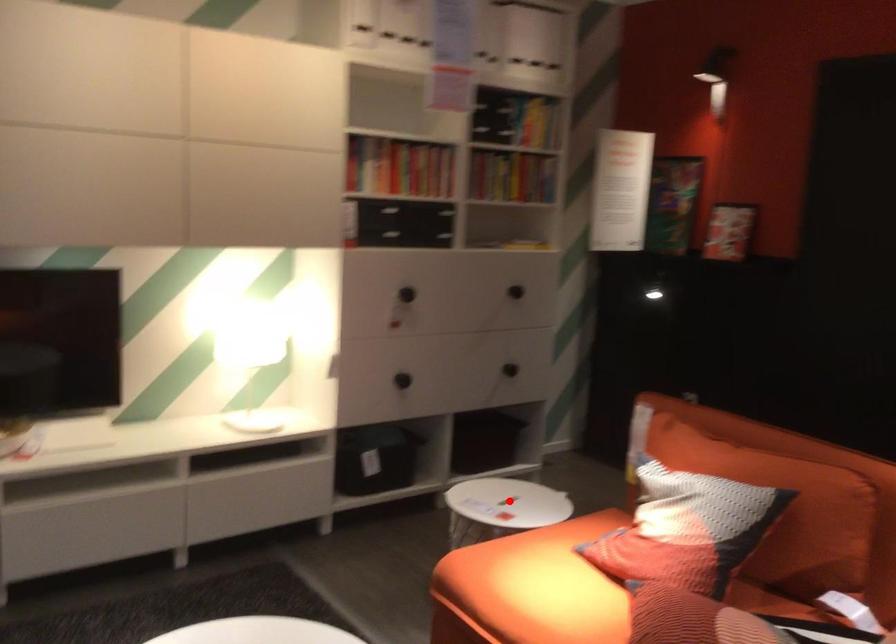
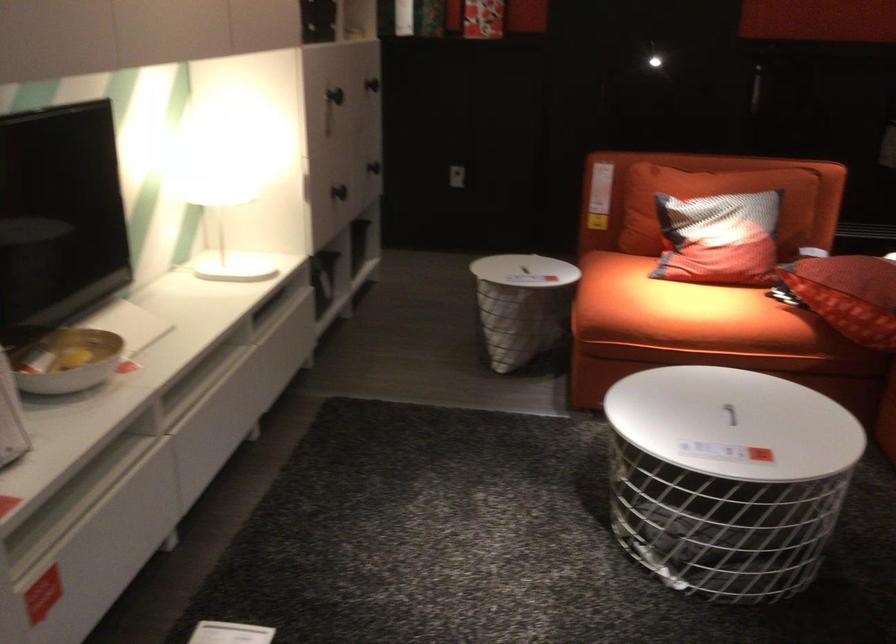
In the second image, find the point that corresponds to the highlighted location in the first image.

(522, 270)